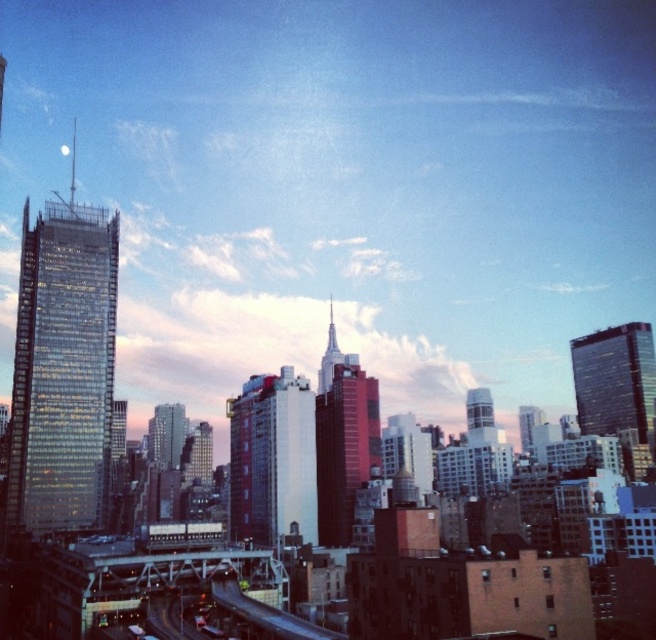
You are an architect analyzing the city skyline. You observe the glassy reflective skyscraper at left and the glassy reflective skyscraper at upper center. Which of these two buildings has a greater width?

The glassy reflective skyscraper at left has a greater width than the glassy reflective skyscraper at upper center.

You are standing at the base of the glass skyscraper on the left and want to take a photo of the point at coordinates point (619,337). If your camera has a maximum focus range of 200 meters, will you be able to capture the point clearly?

The distance of point (619,337) from camera is 210.36 meters, which exceeds the camera maximum focus range of 200 meters. Therefore, you cannot capture the point clearly.

You are a city planner assessing the skyline. You need to determine which of the two buildings, the red brick building at center or the glassy reflective skyscraper at upper center, has a wider base. Based on the scene, which one is wider?

The glassy reflective skyscraper at upper center has a wider base than the red brick building at center, as the red brick building at center is narrower in width compared to the glassy reflective skyscraper at upper center.